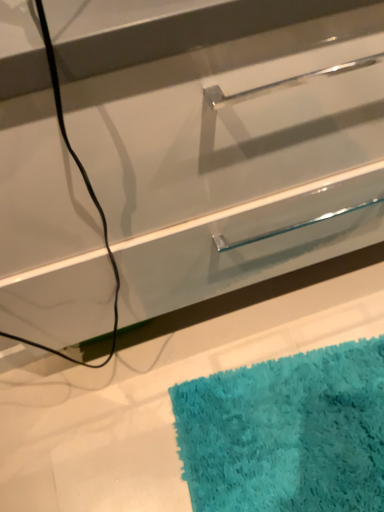
At what (x,y) coordinates should I click in order to perform the action: click on free area below turquoise shaggy bath mat at lower right (from a real-world perspective). Please return your answer as a coordinate pair (x, y). The height and width of the screenshot is (512, 384). Looking at the image, I should click on (318, 447).